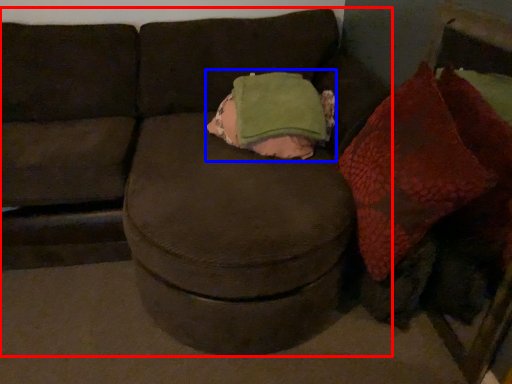
Question: Which object is further to the camera taking this photo, studio couch (highlighted by a red box) or throw pillow (highlighted by a blue box)?

Choices:
 (A) studio couch
 (B) throw pillow

Answer: (B)